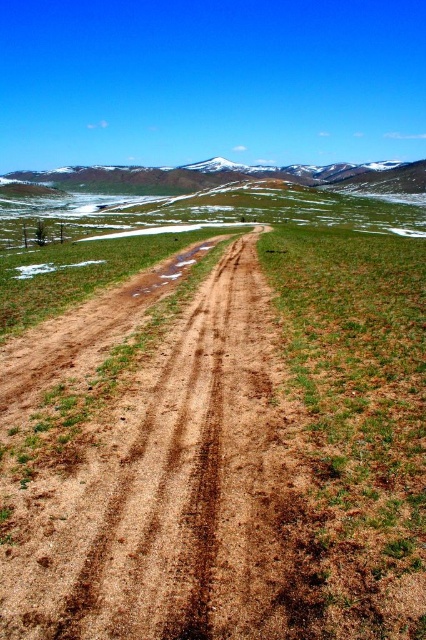
Question: Can you confirm if brown dirt road at center is positioned to the left of snowy rocky mountain at upper center?

Choices:
 (A) no
 (B) yes

Answer: (A)

Question: Can you confirm if brown dirt road at center is positioned below snowy rocky mountain at upper center?

Choices:
 (A) yes
 (B) no

Answer: (A)

Question: Is brown dirt road at center smaller than snowy rocky mountain at upper center?

Choices:
 (A) yes
 (B) no

Answer: (A)

Question: Which point is closer to the camera?

Choices:
 (A) (409, 173)
 (B) (411, 317)

Answer: (B)

Question: Among these points, which one is farthest from the camera?

Choices:
 (A) (314, 177)
 (B) (181, 284)

Answer: (A)